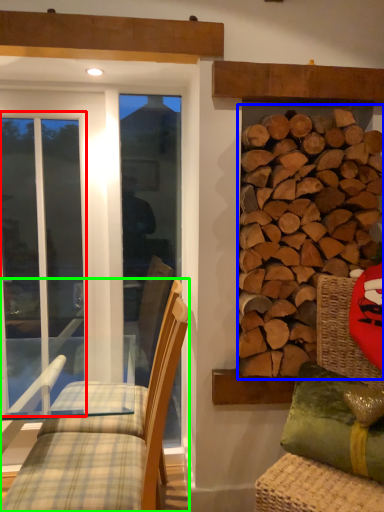
Question: Considering the real-world distances, which object is farthest from screen door (highlighted by a red box)? hardwood (highlighted by a blue box) or chair (highlighted by a green box)?

Choices:
 (A) hardwood
 (B) chair

Answer: (A)